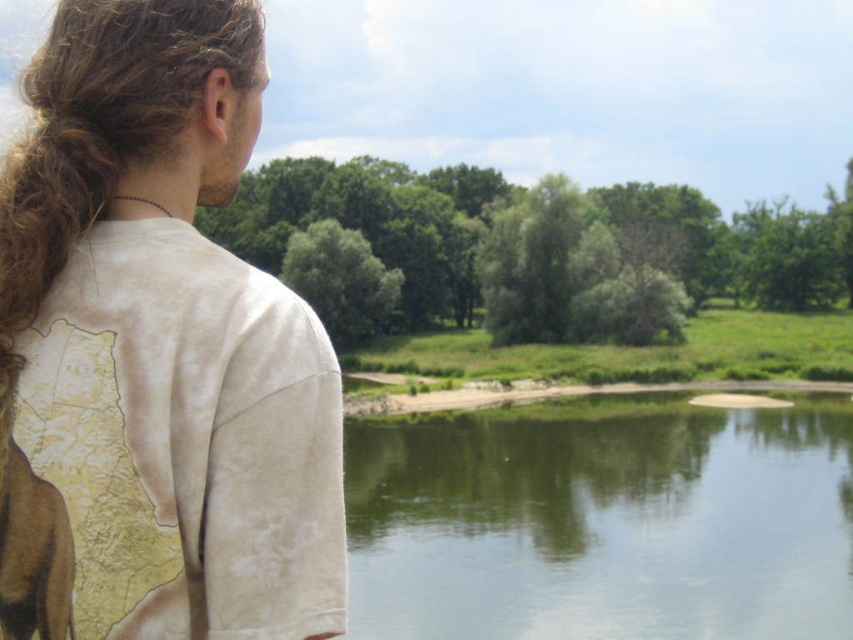
Question: Can you confirm if white cotton shirt at left is smaller than green smooth water at center?

Choices:
 (A) yes
 (B) no

Answer: (A)

Question: Is white cotton shirt at left smaller than green smooth water at center?

Choices:
 (A) no
 (B) yes

Answer: (B)

Question: Does white cotton shirt at left lie behind green smooth water at center?

Choices:
 (A) yes
 (B) no

Answer: (B)

Question: Among these points, which one is farthest from the camera?

Choices:
 (A) (20, 516)
 (B) (662, 525)

Answer: (B)

Question: Which point is farther to the camera?

Choices:
 (A) green smooth water at center
 (B) white cotton shirt at left

Answer: (A)

Question: Which of the following is the farthest from the observer?

Choices:
 (A) white cotton shirt at left
 (B) green smooth water at center

Answer: (B)